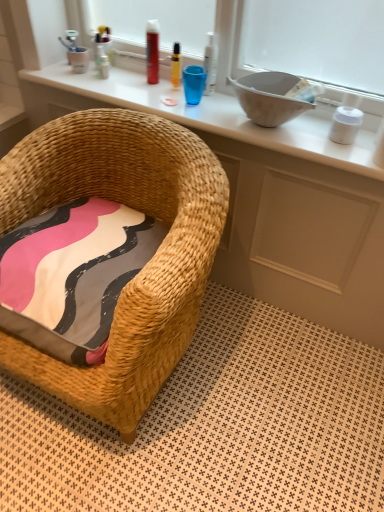
How much space does white plastic bottle at upper center, placed as the 5th toiletry when sorted from right to left, occupy horizontally?

The width of white plastic bottle at upper center, placed as the 5th toiletry when sorted from right to left, is 1.19 inches.

The width and height of the screenshot is (384, 512). What are the coordinates of `translucent yellow bottle at upper center, placed as the third toiletry when sorted from right to left` in the screenshot? It's located at (175, 65).

Find the location of a particular element. The image size is (384, 512). matte wicker vanity at center is located at coordinates (264, 198).

In order to click on woven straw chair at lower left in this screenshot , I will do `click(215, 426)`.

Which object is thinner, woven wood changing table at upper center or gray matte bowl at upper right?

gray matte bowl at upper right is thinner.

From a real-world perspective, is woven wood changing table at upper center above or below gray matte bowl at upper right?

From a real-world perspective, woven wood changing table at upper center is physically below gray matte bowl at upper right.

Considering the relative sizes of woven wood changing table at upper center and gray matte bowl at upper right in the image provided, is woven wood changing table at upper center shorter than gray matte bowl at upper right?

Indeed, woven wood changing table at upper center has a lesser height compared to gray matte bowl at upper right.

From the image's perspective, relative to gray matte bowl at upper right, is woven wood changing table at upper center above or below?

Based on their image positions, woven wood changing table at upper center is located above gray matte bowl at upper right.

From the image's perspective, which is above, white matte container at upper right, marked as the 1th toiletry in a right-to-left arrangement, or white plastic bottle at upper center, the 2th toiletry when ordered from right to left?

white plastic bottle at upper center, the 2th toiletry when ordered from right to left.

Which object is positioned more to the right, white matte container at upper right, which appears as the 5th toiletry when viewed from the left, or white plastic bottle at upper center, the fourth toiletry when ordered from left to right?

white matte container at upper right, which appears as the 5th toiletry when viewed from the left, is more to the right.

Is white matte container at upper right, which appears as the 5th toiletry when viewed from the left, facing towards white plastic bottle at upper center, the fourth toiletry when ordered from left to right?

No, white matte container at upper right, which appears as the 5th toiletry when viewed from the left, does not turn towards white plastic bottle at upper center, the fourth toiletry when ordered from left to right.

Is white matte container at upper right, marked as the 1th toiletry in a right-to-left arrangement, located outside white plastic bottle at upper center, the fourth toiletry when ordered from left to right?

Yes.

Looking at the image, does woven wood changing table at upper center seem bigger or smaller compared to white plastic bottle at upper center, the 2th toiletry when ordered from right to left?

Clearly, woven wood changing table at upper center is larger in size than white plastic bottle at upper center, the 2th toiletry when ordered from right to left.

Looking at this image, from the image's perspective, is woven wood changing table at upper center above or below white plastic bottle at upper center, the fourth toiletry when ordered from left to right?

From the image's perspective, woven wood changing table at upper center appears below white plastic bottle at upper center, the fourth toiletry when ordered from left to right.

Is woven wood changing table at upper center positioned beyond the bounds of white plastic bottle at upper center, the 2th toiletry when ordered from right to left?

woven wood changing table at upper center lies outside white plastic bottle at upper center, the 2th toiletry when ordered from right to left,'s area.

Could you measure the distance between white matte container at upper right, which appears as the 5th toiletry when viewed from the left, and shiny red can at upper center, the second toiletry viewed from the left?

white matte container at upper right, which appears as the 5th toiletry when viewed from the left, is 28.59 inches away from shiny red can at upper center, the second toiletry viewed from the left.

Which is closer, [352,122] or [156,53]?

Point [352,122]

In the scene shown: Is white matte container at upper right, which appears as the 5th toiletry when viewed from the left, at the right side of shiny red can at upper center, positioned as the fourth toiletry in right-to-left order?

Indeed, white matte container at upper right, which appears as the 5th toiletry when viewed from the left, is positioned on the right side of shiny red can at upper center, positioned as the fourth toiletry in right-to-left order.

From a real-world perspective, which is physically below, white matte container at upper right, marked as the 1th toiletry in a right-to-left arrangement, or shiny red can at upper center, the second toiletry viewed from the left?

From a 3D spatial view, white matte container at upper right, marked as the 1th toiletry in a right-to-left arrangement, is below.

Is the surface of woven straw chair at lower left in direct contact with white plastic bottle at upper center, placed as the 5th toiletry when sorted from right to left?

woven straw chair at lower left and white plastic bottle at upper center, placed as the 5th toiletry when sorted from right to left, are clearly separated.

Looking at this image, considering the sizes of objects woven straw chair at lower left and white plastic bottle at upper center, which ranks as the 1th toiletry in left-to-right order, in the image provided, who is bigger, woven straw chair at lower left or white plastic bottle at upper center, which ranks as the 1th toiletry in left-to-right order,?

woven straw chair at lower left.

Which object is further away from the camera taking this photo, woven straw chair at lower left or white plastic bottle at upper center, placed as the 5th toiletry when sorted from right to left?

white plastic bottle at upper center, placed as the 5th toiletry when sorted from right to left, is further from the camera.

Does pink fabric pillow at lower left have a lesser height compared to translucent yellow bottle at upper center, placed as the third toiletry when sorted from right to left?

Yes.

Starting from the pink fabric pillow at lower left, which toiletry is the 4th one behind? Please provide its 2D coordinates.

[(175, 65)]

Does point (148, 246) appear closer or farther from the camera than point (177, 83)?

Point (148, 246) appears to be closer to the viewer than point (177, 83).

Is pink fabric pillow at lower left thinner than translucent yellow bottle at upper center, the third toiletry viewed from the left?

No, pink fabric pillow at lower left is not thinner than translucent yellow bottle at upper center, the third toiletry viewed from the left.

From a real-world perspective, who is located lower, woven straw chair at lower left or shiny red can at upper center, positioned as the fourth toiletry in right-to-left order?

woven straw chair at lower left, from a real-world perspective.

Which is more to the left, woven straw chair at lower left or shiny red can at upper center, the second toiletry viewed from the left?

woven straw chair at lower left is more to the left.

At what (x,y) coordinates should I click in order to perform the action: click on changing table above the gray matte bowl at upper right (from the image's perspective). Please return your answer as a coordinate pair (x, y). The image size is (384, 512). Looking at the image, I should click on (216, 116).

Locate an element on the screen. Image resolution: width=384 pixels, height=512 pixels. the 1st toiletry to the left of the white matte container at upper right, which appears as the 5th toiletry when viewed from the left, counting from the anchor's position is located at coordinates (210, 63).

Considering their positions, is white plastic bottle at upper center, the 2th toiletry when ordered from right to left, positioned further to white plastic bottle at upper center, placed as the 5th toiletry when sorted from right to left, than woven straw chair at lower left?

woven straw chair at lower left is further to white plastic bottle at upper center, placed as the 5th toiletry when sorted from right to left.

Based on their spatial positions, is shiny red can at upper center, the second toiletry viewed from the left, or pink fabric pillow at lower left further from woven wood changing table at upper center?

The object further to woven wood changing table at upper center is pink fabric pillow at lower left.

Which object lies further to the anchor point woven straw chair at lower left, white plastic bottle at upper center, the 2th toiletry when ordered from right to left, or gray matte bowl at upper right?

white plastic bottle at upper center, the 2th toiletry when ordered from right to left, lies further to woven straw chair at lower left than the other object.

Based on their spatial positions, is woven wood changing table at upper center or matte wicker vanity at center closer to pink fabric pillow at lower left?

Among the two, woven wood changing table at upper center is located nearer to pink fabric pillow at lower left.

From the image, which object appears to be farther from woven wood changing table at upper center, pink fabric pillow at lower left or matte wicker vanity at center?

pink fabric pillow at lower left lies further to woven wood changing table at upper center than the other object.

From the image, which object appears to be nearer to white matte container at upper right, marked as the 1th toiletry in a right-to-left arrangement, white plastic bottle at upper center, which ranks as the 1th toiletry in left-to-right order, or woven straw chair at lower left?

woven straw chair at lower left is positioned closer to the anchor white matte container at upper right, marked as the 1th toiletry in a right-to-left arrangement.

Considering their positions, is gray matte bowl at upper right positioned closer to woven straw chair at lower left than shiny red can at upper center, positioned as the fourth toiletry in right-to-left order?

Among the two, gray matte bowl at upper right is located nearer to woven straw chair at lower left.

Which object lies further to the anchor point translucent yellow bottle at upper center, the third toiletry viewed from the left, gray matte bowl at upper right or woven straw chair at lower left?

The object further to translucent yellow bottle at upper center, the third toiletry viewed from the left, is woven straw chair at lower left.

Where is `chair that lies between shiny red can at upper center, the second toiletry viewed from the left, and woven straw chair at lower left from top to bottom`? This screenshot has width=384, height=512. chair that lies between shiny red can at upper center, the second toiletry viewed from the left, and woven straw chair at lower left from top to bottom is located at coordinates (145, 265).

Image resolution: width=384 pixels, height=512 pixels. I want to click on toiletry between gray matte bowl at upper right and woven straw chair at lower left vertically, so click(x=345, y=125).

The width and height of the screenshot is (384, 512). In order to click on vanity between white plastic bottle at upper center, which ranks as the 1th toiletry in left-to-right order, and gray matte bowl at upper right in this screenshot , I will do `click(264, 198)`.

In order to click on sink between shiny red can at upper center, the second toiletry viewed from the left, and pink fabric pillow at lower left in the up-down direction in this screenshot , I will do `click(269, 97)`.